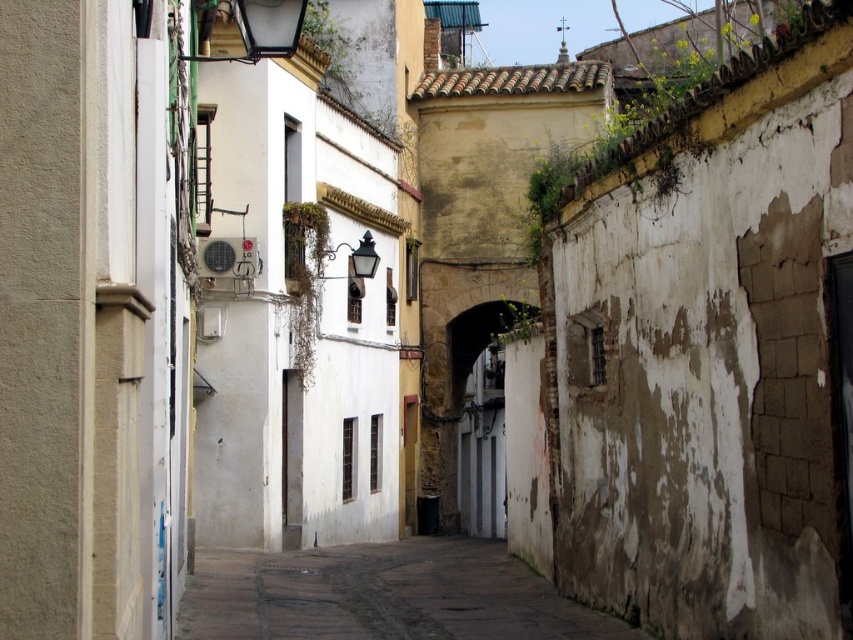
You are standing in the middle of the narrow cobblestone alleyway described in the scene. There is a smooth stone section marked by the point at coordinates (383, 595). If you want to walk directly towards the right side building with the rough, textured facade, will you pass through this smooth stone section?

Yes, the smooth stone alley at center is located at point (383, 595), which is directly in the path towards the right side building with the rough, textured facade. Therefore, you will pass through this smooth stone section.

You are standing at the entrance of the alley and want to walk towards the smooth stone alley at center. Which direction should you move relative to the buildings on the left and right?

The smooth stone alley at center is located at point coordinates, so you should move forward along the alley between the buildings on the left and right to reach it.

You are a delivery person trying to navigate a narrow alleyway. You see the smooth stone alley at center and the white stone archway at center. Which one has a larger size?

Answer: The white stone archway at center is larger than the smooth stone alley at center.